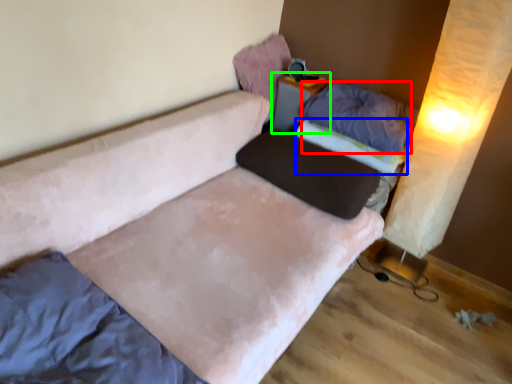
Question: Based on their relative distances, which object is farther from pillow (highlighted by a red box)? Choose from mattress (highlighted by a blue box) and table (highlighted by a green box).

Choices:
 (A) mattress
 (B) table

Answer: (B)